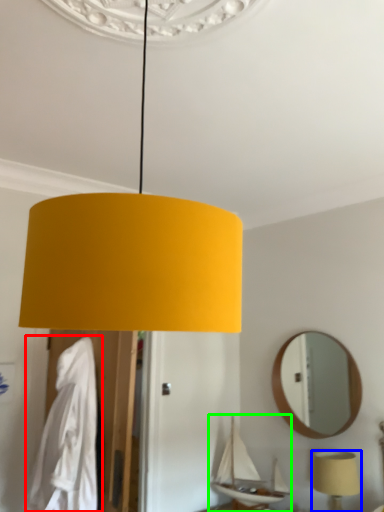
Question: Which object is the closest to the robe (highlighted by a red box)? Choose among these: lamp (highlighted by a blue box) or boat (highlighted by a green box).

Choices:
 (A) lamp
 (B) boat

Answer: (B)